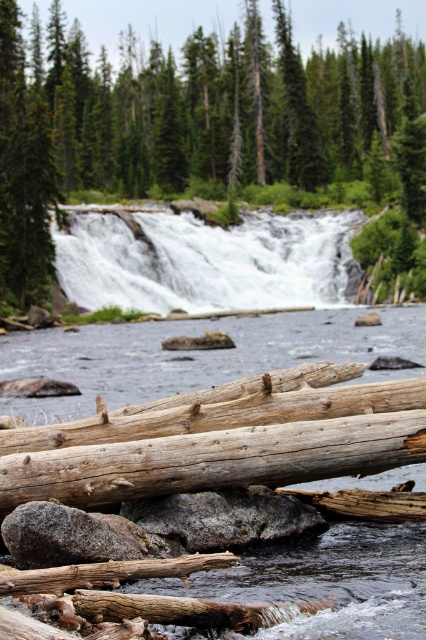
You are standing at the base of the waterfall and want to take a photo of the green textured tree at upper center. Given the tree is positioned at coordinates approximately 0.198 on the x and 0.469 on the y axis, would you need to move to your left or right to center the tree in your camera view?

The green textured tree at upper center is located at point [199,125], which means it is positioned to the left side of the image. To center it in your camera view, you would need to move to your right to align the tree properly.

You are an environmental scientist assessing the area around the waterfall. You notice the green textured tree at upper center and the white frothy water at center. Which object occupies a greater area in the scene?

The green textured tree at upper center has a larger size compared to the white frothy water at center, so it occupies a greater area in the scene.

You are a hiker trying to cross the river using the logs. The white frothy water at center is flowing rapidly. Can you safely step onto the weathered wood log at lower center without getting your feet wet?

The weathered wood log at lower center is shorter than the white frothy water at center, meaning the log is submerged under the water. Therefore, stepping onto it would likely get your feet wet.